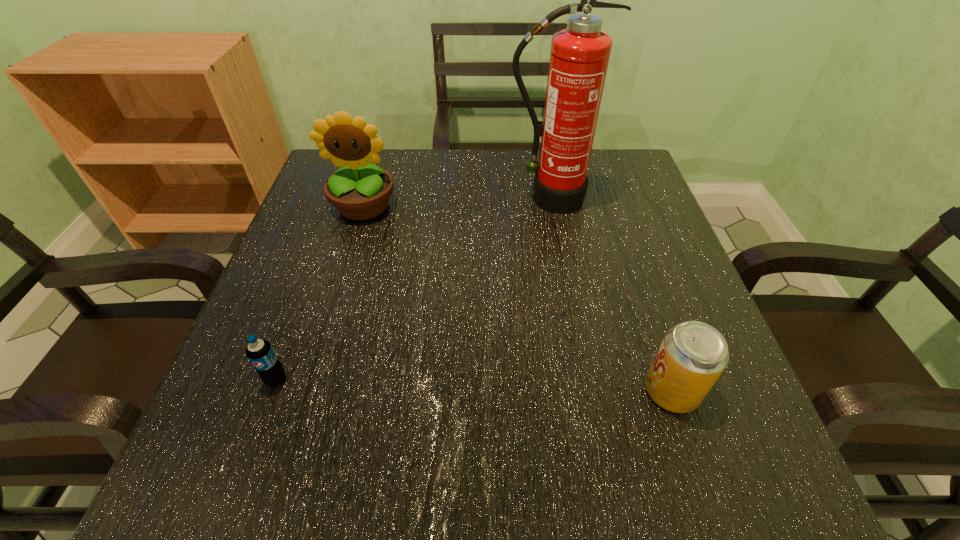
Where is `the tallest object`? The width and height of the screenshot is (960, 540). the tallest object is located at coordinates (579, 57).

Locate an element on the screen. the second tallest object is located at coordinates (362, 192).

Locate an element on the screen. The width and height of the screenshot is (960, 540). the taller soda bottle is located at coordinates (692, 356).

Where is `the second shortest object`? The image size is (960, 540). the second shortest object is located at coordinates (692, 356).

Where is `the left soda bottle`? the left soda bottle is located at coordinates (260, 353).

Find the location of a particular element. the shortest object is located at coordinates (260, 353).

In order to click on free spot located on the front-facing side of the fire extinguisher in this screenshot , I will do `click(567, 302)`.

Locate an element on the screen. The width and height of the screenshot is (960, 540). vacant point located 0.100m on the face of the third shortest object is located at coordinates (348, 258).

This screenshot has width=960, height=540. What are the coordinates of `free space located on the back of the third tallest object` in the screenshot? It's located at (630, 268).

Identify the location of free region located 0.310m on the back of the shorter soda bottle. (326, 243).